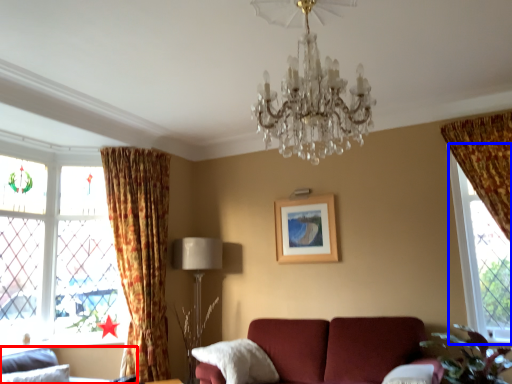
Question: Which of the following is the farthest to the observer, studio couch (highlighted by a red box) or window (highlighted by a blue box)?

Choices:
 (A) studio couch
 (B) window

Answer: (B)